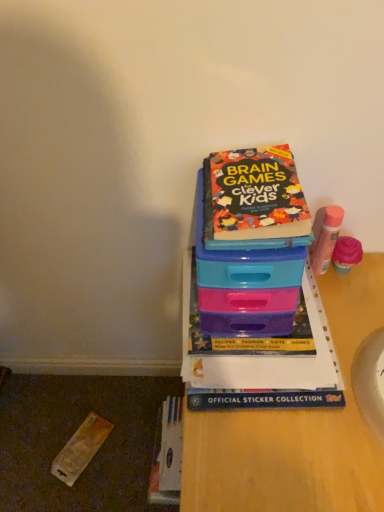
Question: Is hardcover book at center, arranged as the 2th book when viewed from the top, taller or shorter than multicolored paper book at upper center, the second book ordered from the bottom?

Choices:
 (A) tall
 (B) short

Answer: (B)

Question: From the image's perspective, is hardcover book at center, arranged as the 2th book when viewed from the top, above or below multicolored paper book at upper center, the 1th book when ordered from top to bottom?

Choices:
 (A) above
 (B) below

Answer: (B)

Question: Estimate the real-world distances between objects in this image. Which object is closer to the multicolored paper book at upper center, the second book ordered from the bottom?

Choices:
 (A) plastic at center
 (B) hardcover book at center, arranged as the 1th book when ordered from the bottom

Answer: (B)

Question: Based on their relative distances, which object is farther from the plastic at center?

Choices:
 (A) multicolored paper book at upper center, the 1th book when ordered from top to bottom
 (B) hardcover book at center, arranged as the 1th book when ordered from the bottom

Answer: (A)